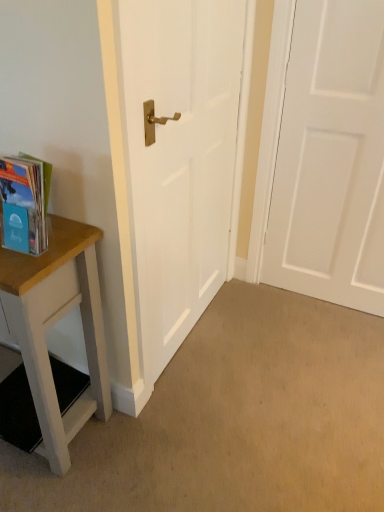
This screenshot has height=512, width=384. I want to click on free spot in front of translucent plastic book at left, so coord(22,267).